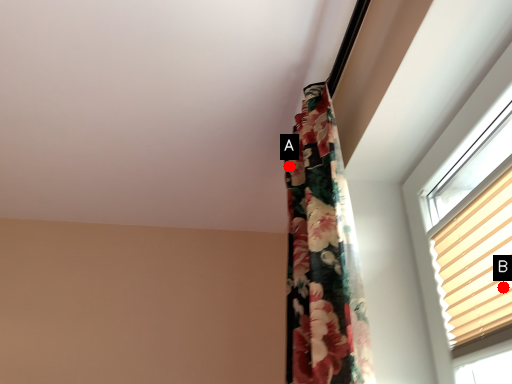
Question: Two points are circled on the image, labeled by A and B beside each circle. Which of the following is the closest to the observer?

Choices:
 (A) A is closer
 (B) B is closer

Answer: (B)